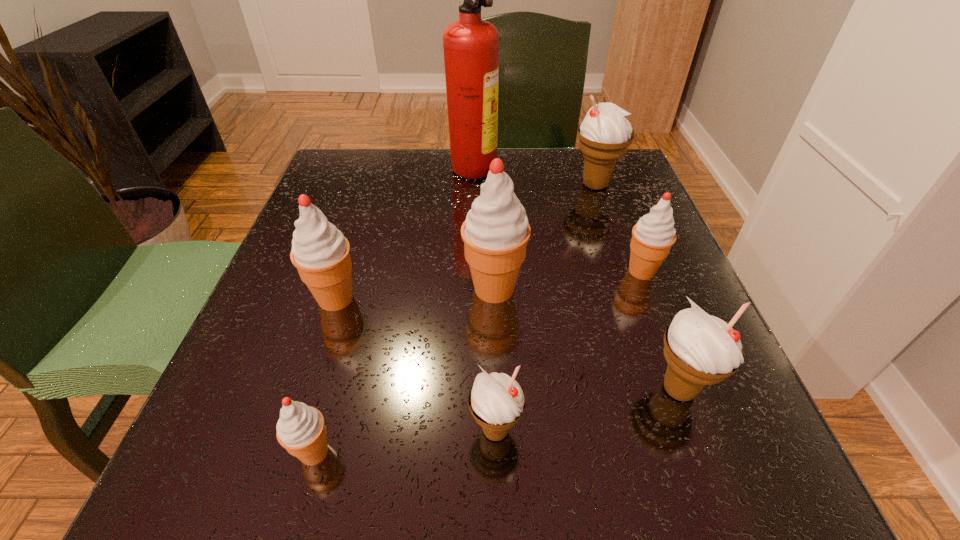
Locate an element on the screen. The width and height of the screenshot is (960, 540). free region that satisfies the following two spatial constraints: 1. on the front-facing side of the tallest object; 2. on the right side of the second smallest white icecream is located at coordinates (467, 389).